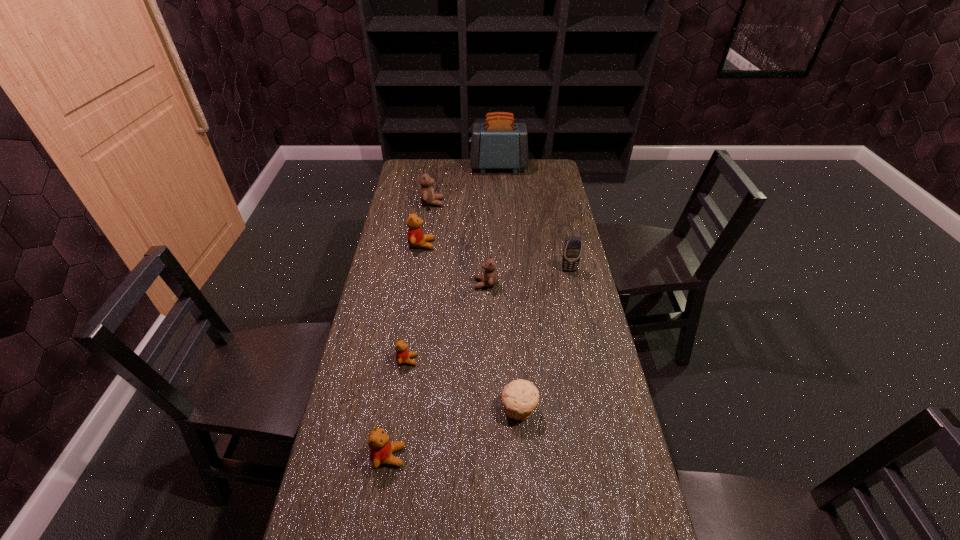
Image resolution: width=960 pixels, height=540 pixels. Find the location of `cellular telephone located in the right edge section of the desktop`. cellular telephone located in the right edge section of the desktop is located at coordinates (572, 250).

Find the location of `object present at the far right corner`. object present at the far right corner is located at coordinates click(499, 143).

In the image, there is a desktop. At what (x,y) coordinates should I click in order to perform the action: click on vacant space at the far edge. Please return your answer as a coordinate pair (x, y). The image size is (960, 540). Looking at the image, I should click on (x=459, y=170).

Find the location of a particular element. blank space at the left edge is located at coordinates (396, 284).

Where is `free space at the right edge of the desktop`? free space at the right edge of the desktop is located at coordinates (533, 199).

The height and width of the screenshot is (540, 960). In the image, there is a desktop. Find the location of `free space at the far left corner`. free space at the far left corner is located at coordinates (402, 175).

The width and height of the screenshot is (960, 540). What are the coordinates of `free spot at the far right corner of the desktop` in the screenshot? It's located at (542, 174).

Locate an element on the screen. This screenshot has height=540, width=960. empty space that is in between the beige muffin and the rightmost teddy bear is located at coordinates (502, 347).

Image resolution: width=960 pixels, height=540 pixels. I want to click on empty space that is in between the tallest object and the muffin, so click(x=509, y=288).

The image size is (960, 540). Find the location of `free space between the nearest object and the smallest red teddy bear`. free space between the nearest object and the smallest red teddy bear is located at coordinates (398, 408).